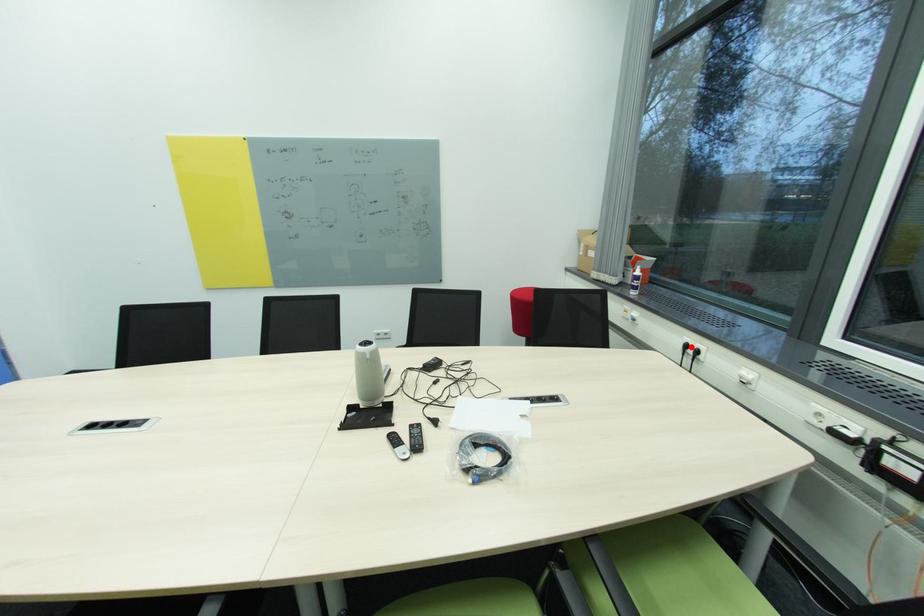
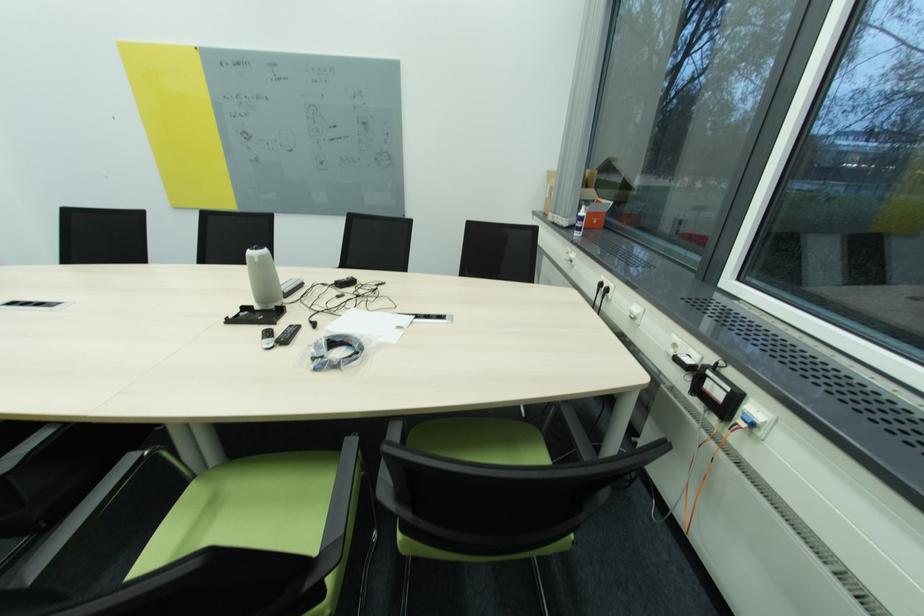
Question: A red point is marked in image1. In image2, is the corresponding 3D point closer to the camera or farther? Reply with the corresponding letter.

Choices:
 (A) The corresponding 3D point is closer.
 (B) The corresponding 3D point is farther.

Answer: (A)